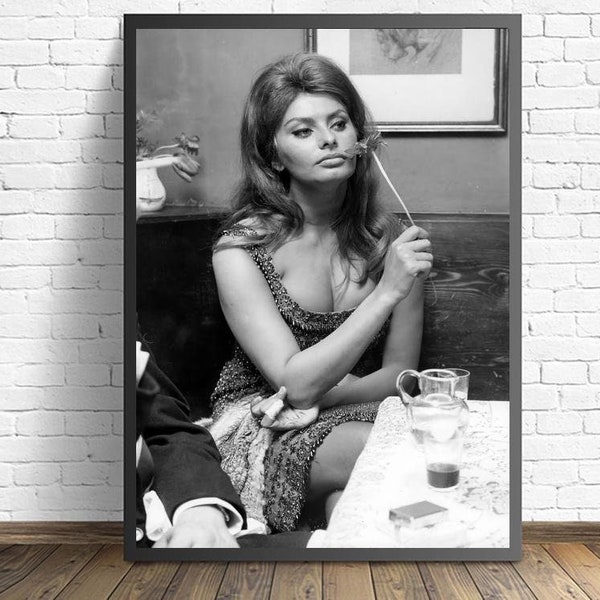
You are a GUI agent. You are given a task and a screenshot of the screen. Output one action in this format:
    pyautogui.click(x=<x>, y=<y>)
    Task: Click on the wood trim
    This screenshot has width=600, height=600.
    Given the screenshot: What is the action you would take?
    pyautogui.click(x=86, y=536)